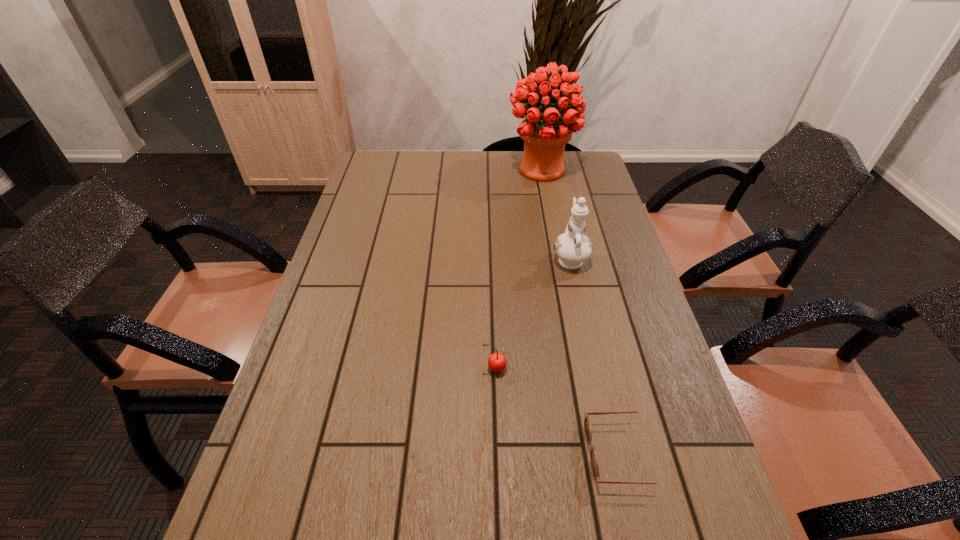
Locate an element on the screen. The image size is (960, 540). vacant space that's between the leftmost object and the farthest object is located at coordinates (517, 269).

Where is `vacant region between the second nearest object and the farthest object`? The image size is (960, 540). vacant region between the second nearest object and the farthest object is located at coordinates (517, 269).

This screenshot has height=540, width=960. Identify the location of vacant space that's between the third farthest object and the bouquet. (517, 269).

The width and height of the screenshot is (960, 540). Find the location of `blank region between the farthest object and the leftmost object`. blank region between the farthest object and the leftmost object is located at coordinates click(517, 269).

You are a GUI agent. You are given a task and a screenshot of the screen. Output one action in this format:
    pyautogui.click(x=<x>, y=<y>)
    Task: Click on the vacant area between the tallest object and the cherry
    The height and width of the screenshot is (540, 960).
    Given the screenshot: What is the action you would take?
    pyautogui.click(x=517, y=269)

Identify the location of object that is the third closest one to the third shortest object. (587, 426).

Select which object appears as the third closest to the chinaware. Please provide its 2D coordinates. Your answer should be formatted as a tuple, i.e. [(x, y)], where the tuple contains the x and y coordinates of a point satisfying the conditions above.

[(587, 426)]